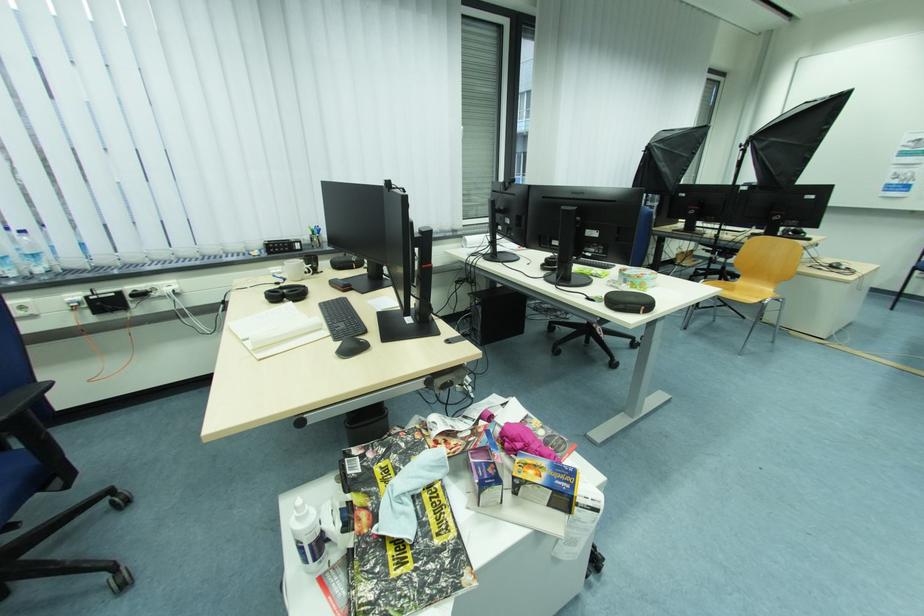
The location [313,248] corresponds to which object?

This point indicates the black pen holder.